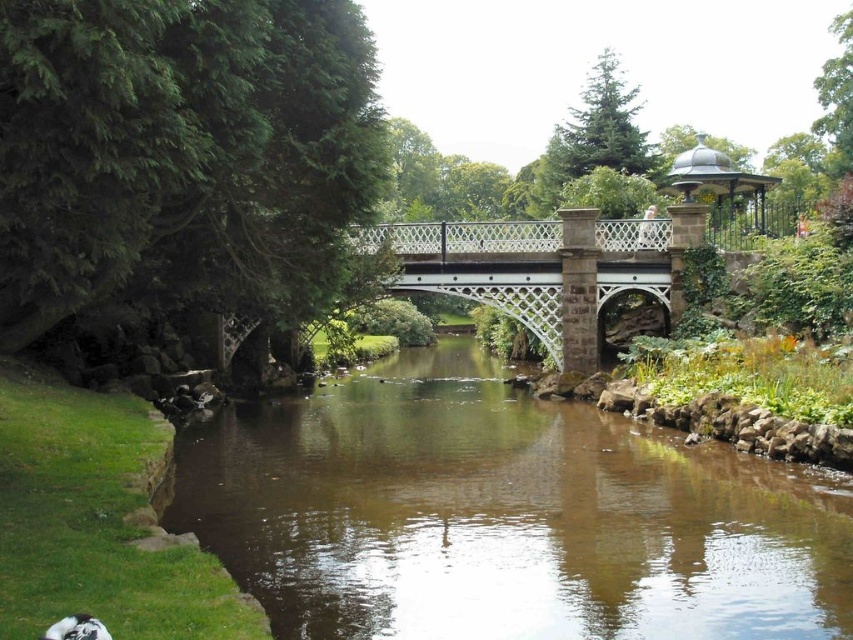
You are a photographer planning to capture the entire white metal bridge at center and brown smooth water at center in one shot. Given that your camera can only focus on objects within a 10m width, can both objects fit in the frame if the bridge is 6 meters wide?

The brown smooth water at center is bigger than the white metal bridge at center, which is 6 meters wide. Since the water is larger, the total width required to capture both would exceed 10 meters. Therefore, both objects cannot fit within the camera frame.

You are an architect designing a miniature model of this scene. You have limited space on your model board. Which object should you prioritize placing first to ensure it fits properly? The white metal bridge at center or the polished metal gazebo at upper right?

The polished metal gazebo at upper right should be placed first because it occupies more space than the white metal bridge at center, ensuring it fits properly before arranging the smaller bridge.

You are a photographer planning to capture the white metal bridge at center and the brown smooth water at center in a single shot. Based on their heights, which one should you focus on first to ensure both are in frame?

The brown smooth water at center is shorter than the white metal bridge at center, so you should focus on the white metal bridge at center first to ensure both are in frame.